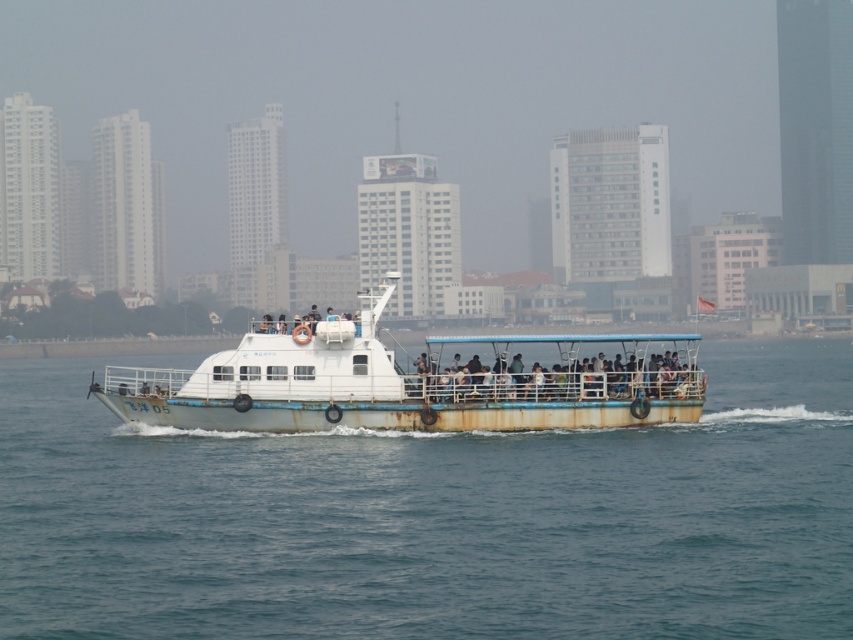
Question: Is the position of blue water at center less distant than that of white matte boat at center?

Choices:
 (A) no
 (B) yes

Answer: (B)

Question: Is blue water at center bigger than white matte boat at center?

Choices:
 (A) yes
 (B) no

Answer: (A)

Question: Can you confirm if blue water at center is wider than white matte boat at center?

Choices:
 (A) yes
 (B) no

Answer: (A)

Question: Which point is farther to the camera?

Choices:
 (A) blue water at center
 (B) white matte boat at center

Answer: (B)